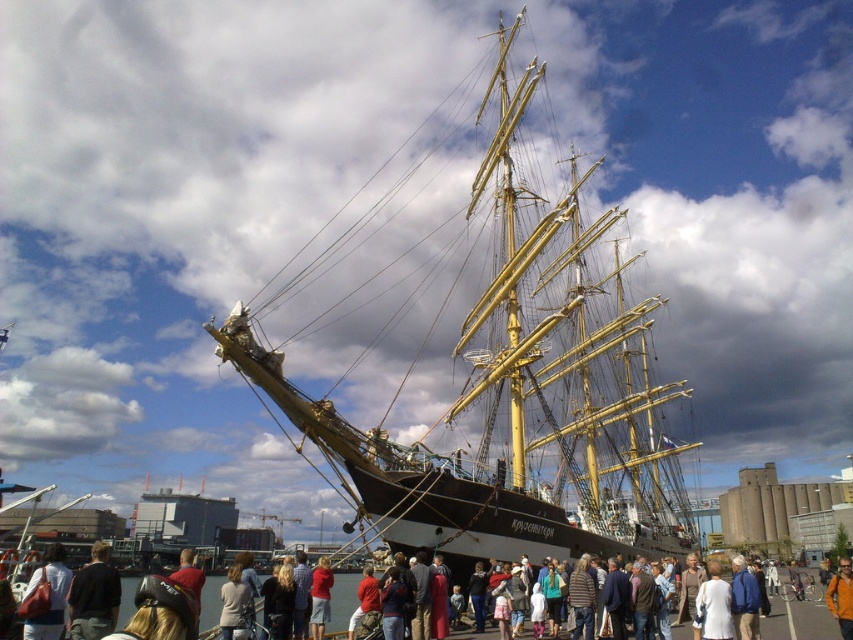
Question: Which point is closer to the camera taking this photo?

Choices:
 (A) (96, 618)
 (B) (838, 556)
 (C) (41, 627)

Answer: (A)

Question: Can you confirm if wooden ship at center is positioned below orange fabric jacket at center?

Choices:
 (A) yes
 (B) no

Answer: (B)

Question: Among these objects, which one is nearest to the camera?

Choices:
 (A) matte white shirt at lower left
 (B) dark brown leather jacket at lower left
 (C) orange fabric jacket at center
 (D) wooden ship at center

Answer: (D)

Question: Can you confirm if dark brown leather jacket at lower left is positioned to the left of orange fabric jacket at center?

Choices:
 (A) no
 (B) yes

Answer: (B)

Question: Which point appears farthest from the camera in this image?

Choices:
 (A) (74, 636)
 (B) (51, 634)
 (C) (850, 566)

Answer: (C)

Question: Does dark brown leather jacket at lower left lie in front of orange fabric jacket at center?

Choices:
 (A) no
 (B) yes

Answer: (B)